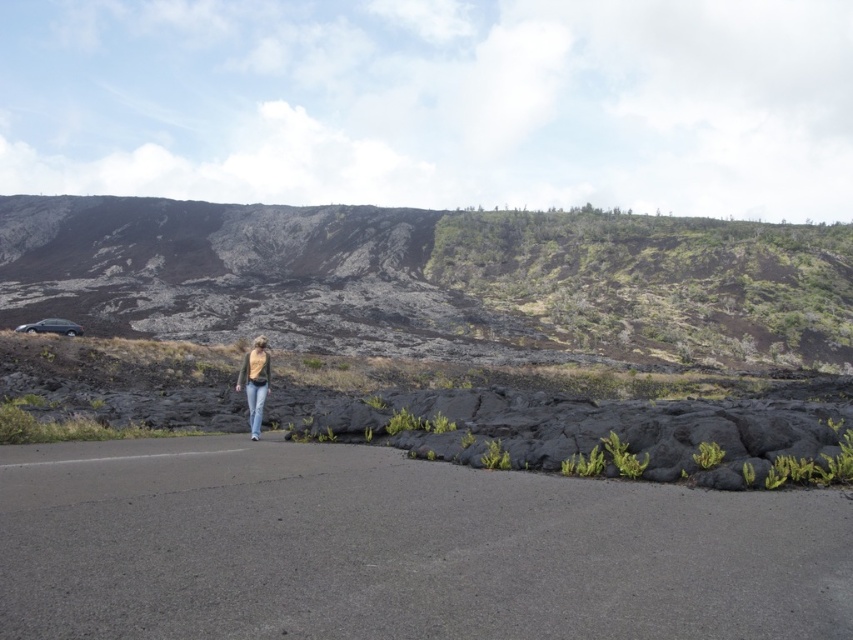
You are a photographer standing at the edge of the volcanic landscape. You notice the asphalt road at center and the denim pants at center in the scene. Which object appears taller in the image?

The denim pants at center appear taller than the asphalt road at center because the asphalt road at center is not as tall as denim pants at center.

Based on the photo, you are a hiker who wants to cross from the asphalt road at center to the denim pants at center. The path is uneven and rocky. Can you safely walk this distance if your hiking boots have a 15 meter endurance limit?

The distance between asphalt road at center and denim pants at center is 14.84 meters, which is within the 15 meter endurance limit of the hiking boots. Therefore, you can safely walk this distance.